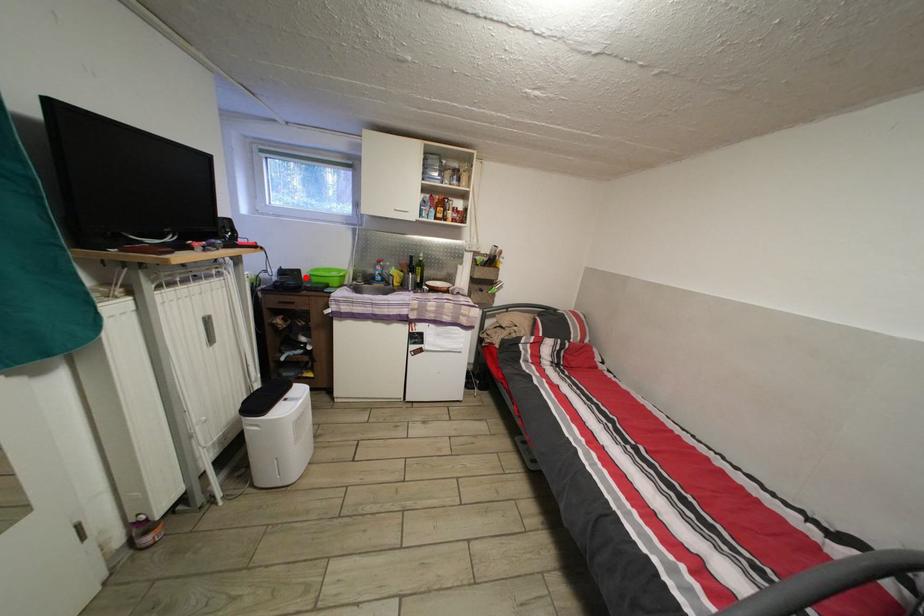
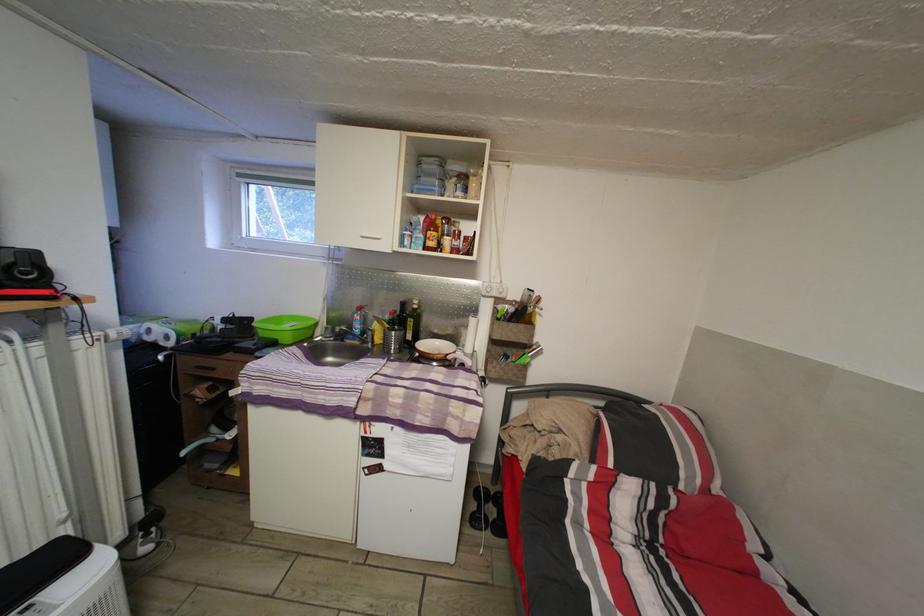
In the second image, find the point that corresponds to the highlighted location in the first image.

(257, 326)